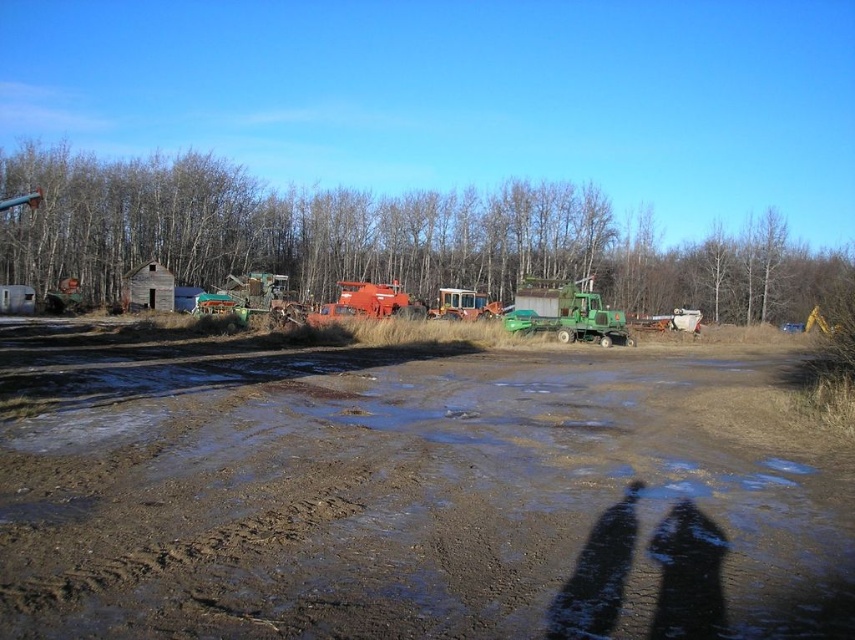
You are standing at the point with coordinates point (154, 284) and want to walk towards the point with coordinates point (230, 460). Since both points are in the image, will you be moving towards or away from the camera?

Point (230, 460) is closer to the camera than point (154, 284). Therefore, moving from point (154, 284) towards point (230, 460) means you are moving closer to the camera.

You are standing at the camera position and want to place a flag at point [243,394] and another flag at point [706,243]. Which flag will be closer to you?

The flag placed at point [243,394] will be closer to you because point [243,394] is closer to the camera than point [706,243].

You are a photographer planning to take a landscape shot of the muddy brown dirt field at center and the brown wood tree at upper center. Which object should you focus on first if you want to capture both in a single frame without moving the camera?

The muddy brown dirt field at center is smaller than the brown wood tree at upper center, so you should focus on the brown wood tree at upper center first to ensure it fits within the frame before adjusting for the smaller field.